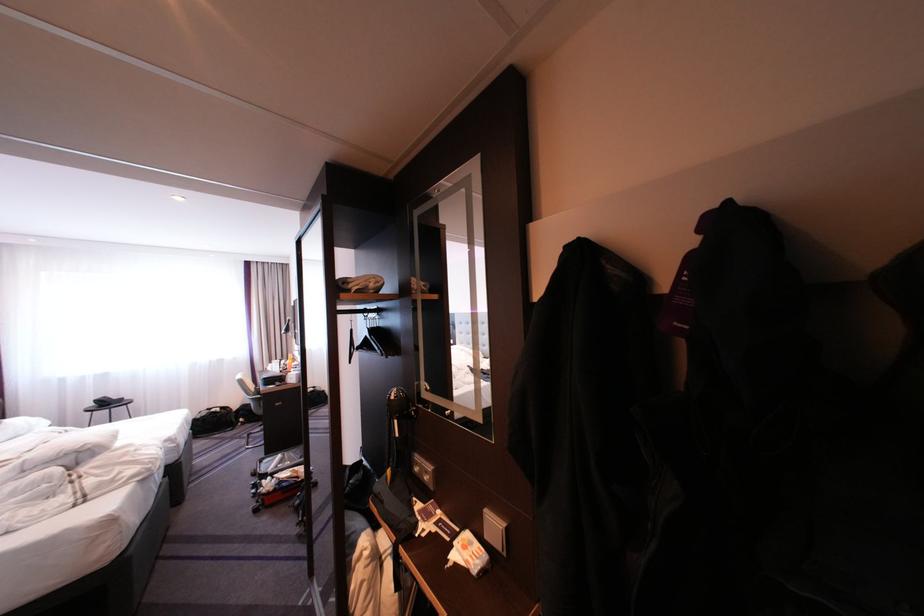
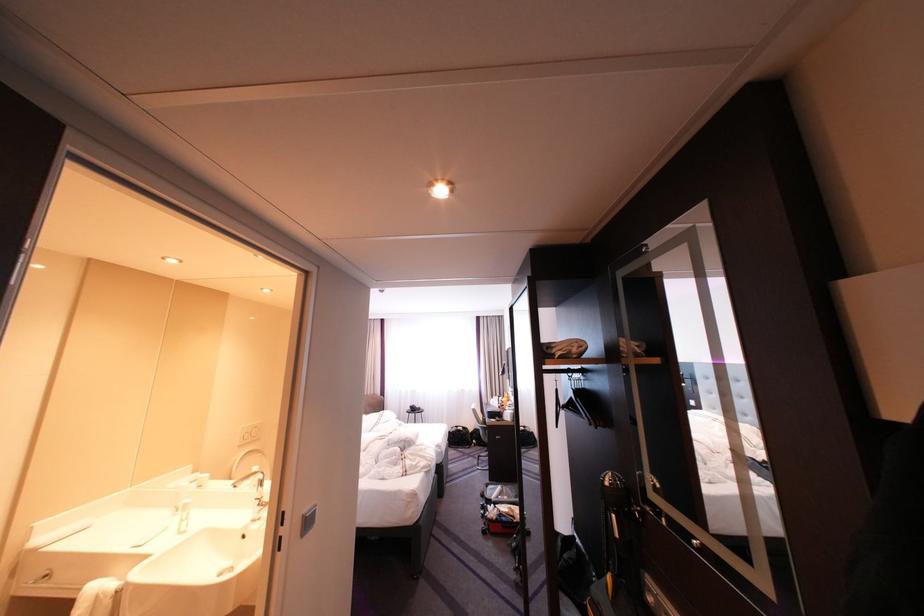
Find the pixel in the second image that matches (278,475) in the first image.

(503, 501)